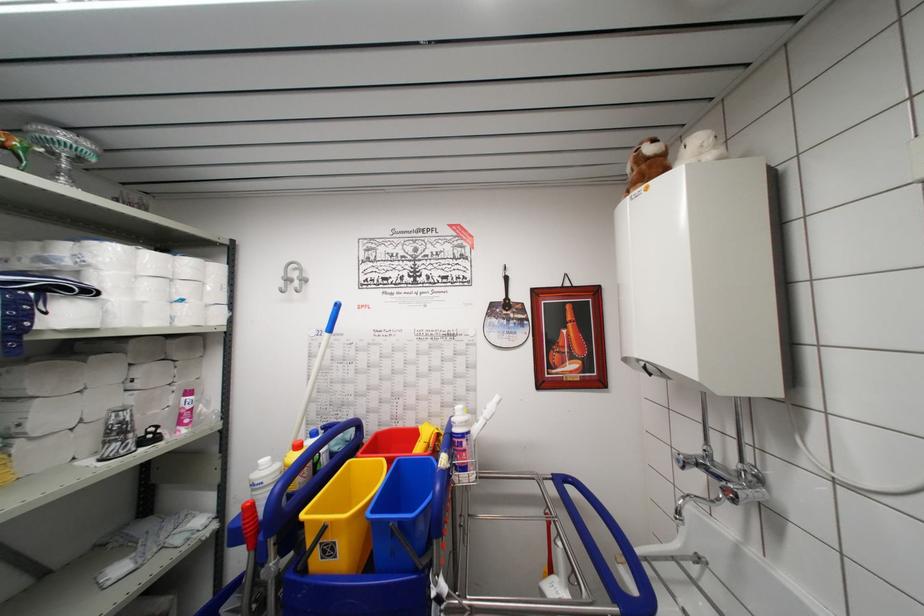
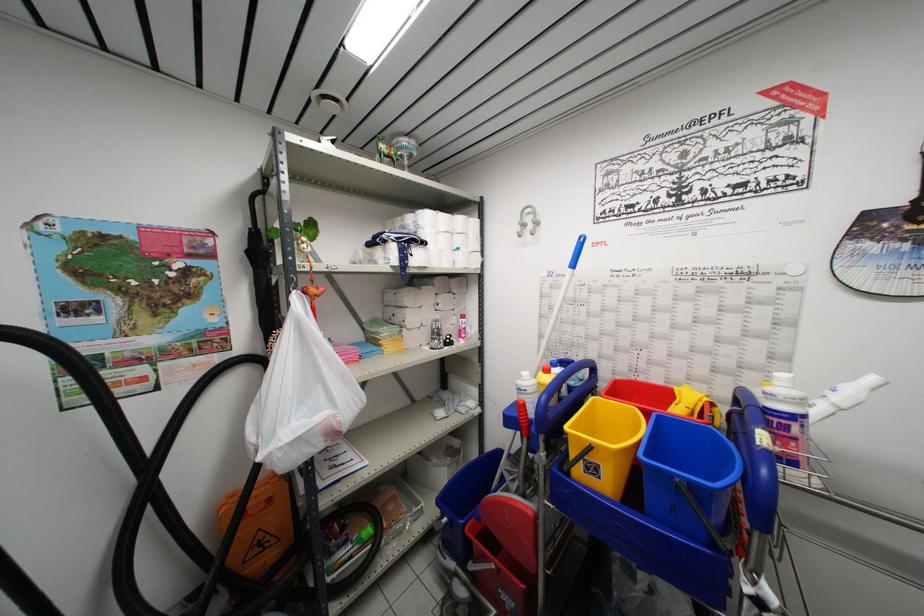
Find the pixel in the second image that matches the point at 325,562 in the first image.

(589, 477)